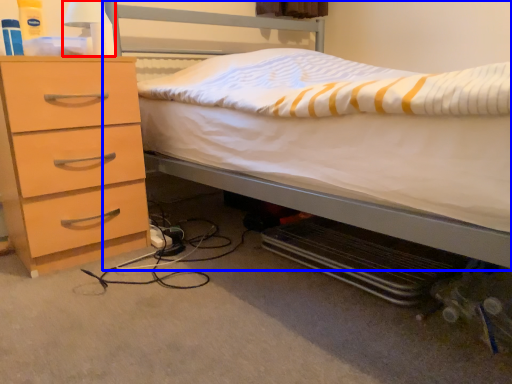
Question: Which point is further to the camera, bedside lamp (highlighted by a red box) or bed (highlighted by a blue box)?

Choices:
 (A) bedside lamp
 (B) bed

Answer: (A)